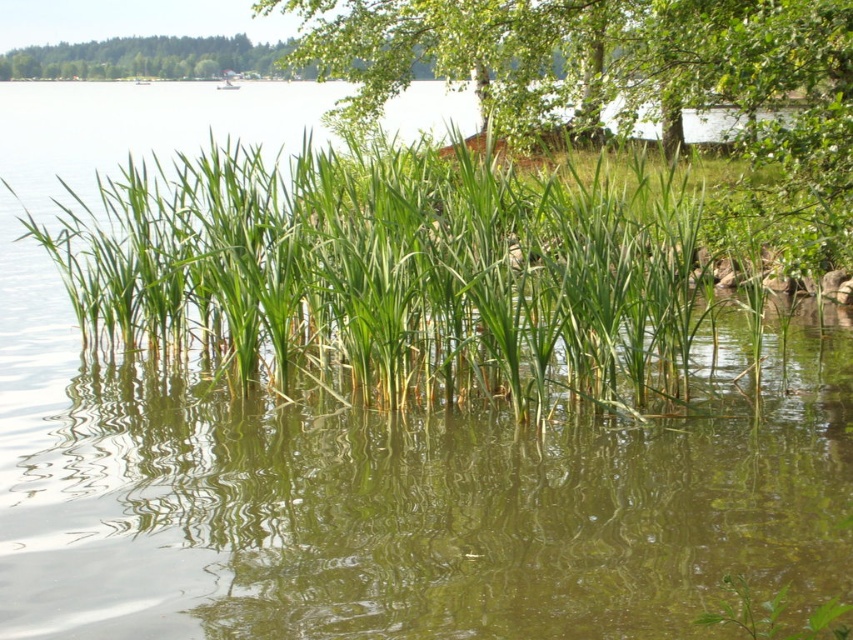
Question: Is green grassy reed at center thinner than green leafy tree at upper center?

Choices:
 (A) no
 (B) yes

Answer: (B)

Question: Which point appears farthest from the camera in this image?

Choices:
 (A) (415, 19)
 (B) (601, 378)

Answer: (A)

Question: Does green grassy reed at center appear on the left side of green leafy tree at upper center?

Choices:
 (A) yes
 (B) no

Answer: (B)

Question: Is green grassy reed at center to the left of green leafy tree at upper center from the viewer's perspective?

Choices:
 (A) no
 (B) yes

Answer: (A)